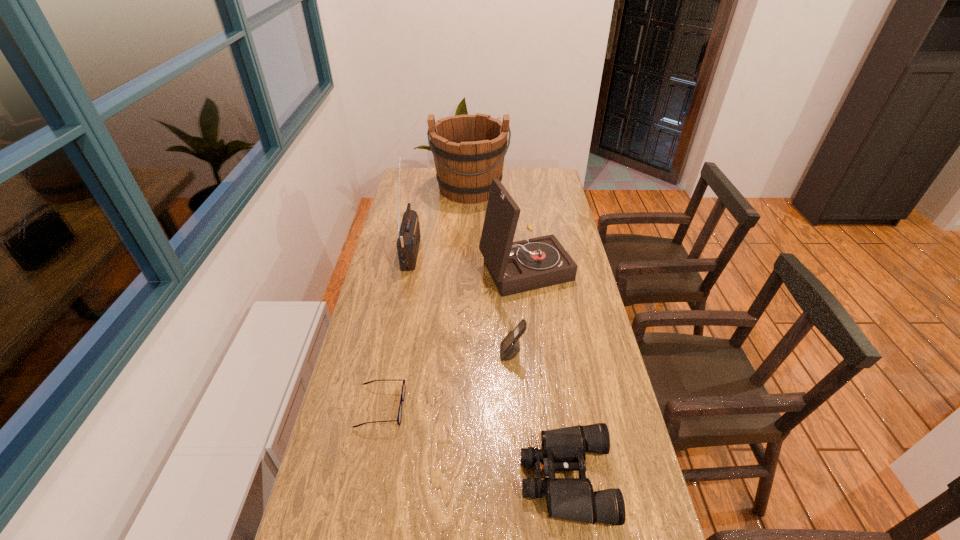
This screenshot has height=540, width=960. What are the coordinates of `phonograph record` in the screenshot? It's located at (515, 267).

Find the location of a particular element. wine bucket is located at coordinates (469, 150).

Where is `radio receiver`? This screenshot has width=960, height=540. radio receiver is located at coordinates (408, 241).

This screenshot has height=540, width=960. I want to click on the third nearest object, so point(510,346).

Find the location of a particular element. The image size is (960, 540). the third shortest object is located at coordinates (510, 346).

Identify the location of binoculars. Image resolution: width=960 pixels, height=540 pixels. (564, 449).

The height and width of the screenshot is (540, 960). Find the location of `the fifth tallest object`. the fifth tallest object is located at coordinates (564, 449).

Find the location of a particular element. the fifth farthest object is located at coordinates (399, 417).

You are a GUI agent. You are given a task and a screenshot of the screen. Output one action in this format:
    pyautogui.click(x=<x>, y=<y>)
    Task: Click on the shortest object
    
    Given the screenshot: What is the action you would take?
    coord(399,417)

Identify the location of free region located on the left of the phonograph record. The image size is (960, 540). (439, 266).